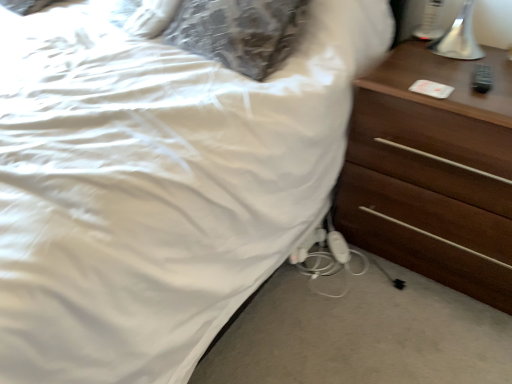
What do you see at coordinates (433, 172) in the screenshot? I see `brown wood chest of drawers at right` at bounding box center [433, 172].

At what (x,y) coordinates should I click in order to perform the action: click on brown wood chest of drawers at right. Please return your answer as a coordinate pair (x, y). Image resolution: width=512 pixels, height=384 pixels. Looking at the image, I should click on (433, 172).

Where is `brown wood chest of drawers at right`? The height and width of the screenshot is (384, 512). brown wood chest of drawers at right is located at coordinates (433, 172).